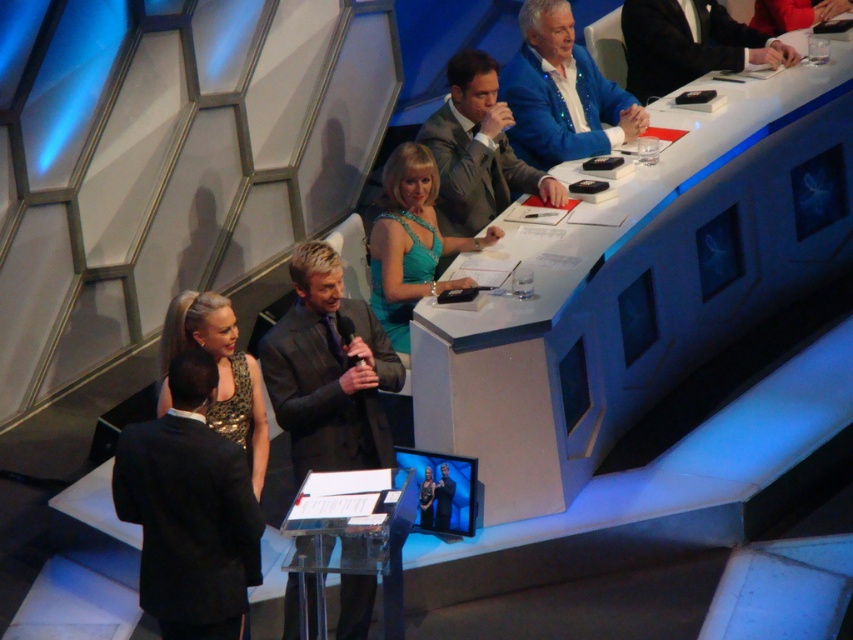
Based on the photo, you are organizing a photoshoot and need to place a large prop between the black silk business suit at upper right and the gold sequined dress at lower left. Based on their sizes, which object should the prop be closer to?

The prop should be closer to the gold sequined dress at lower left because the black silk business suit at upper right occupies less space, meaning the gold sequined dress at lower left is larger and requires more space.